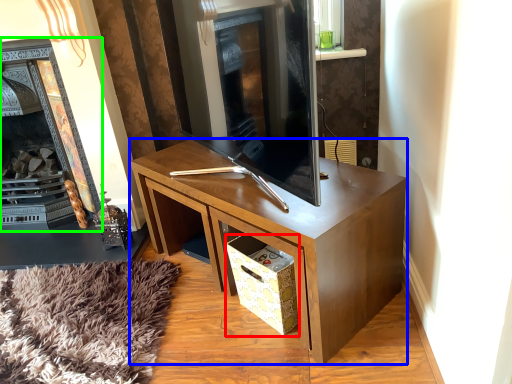
Question: Based on their relative distances, which object is nearer to drawer (highlighted by a red box)? Choose from desk (highlighted by a blue box) and fireplace (highlighted by a green box).

Choices:
 (A) desk
 (B) fireplace

Answer: (A)